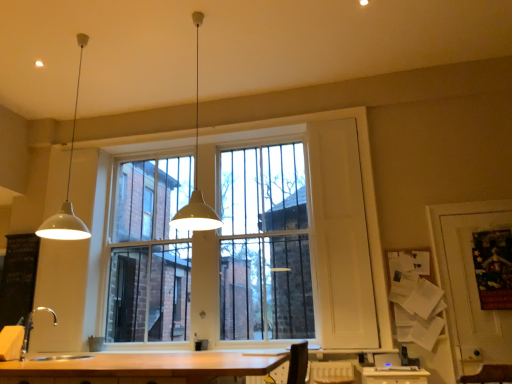
The image size is (512, 384). Identify the location of free space above white matte pendant light at center, the second lamp in the left-to-right sequence (from a real-world perspective). (195, 18).